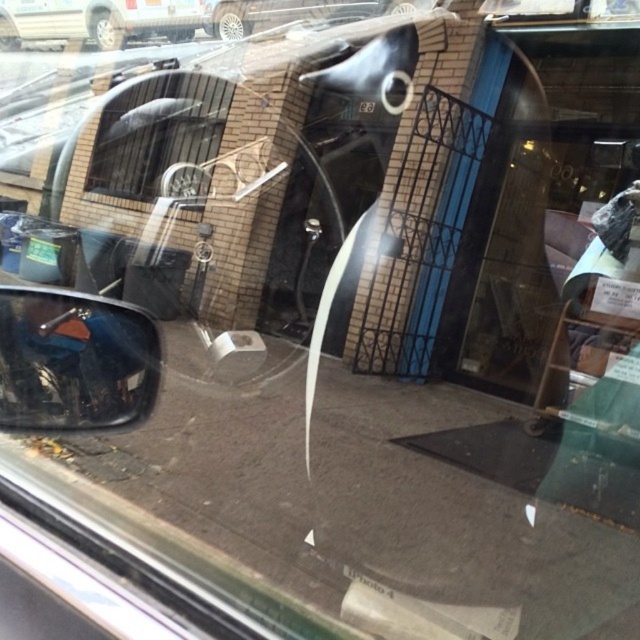
Who is higher up, matte black view mirror at left or metallic silver van at upper left?

metallic silver van at upper left is above.

Which is behind, point (92, 400) or point (29, 17)?

The point (29, 17) is behind.

Identify the location of matte black view mirror at left. (74, 360).

Find the location of a particular element. clear glass window at upper left is located at coordinates (156, 131).

Measure the distance between point (168,83) and camera.

They are 3.45 meters apart.

Locate an element on the screen. Image resolution: width=640 pixels, height=640 pixels. clear glass window at upper left is located at coordinates (156, 131).

Is matte black view mirror at left thinner than clear glass window at upper left?

No, matte black view mirror at left is not thinner than clear glass window at upper left.

Does matte black view mirror at left appear under clear glass window at upper left?

Correct, matte black view mirror at left is located below clear glass window at upper left.

The width and height of the screenshot is (640, 640). In order to click on matte black view mirror at left in this screenshot , I will do `click(74, 360)`.